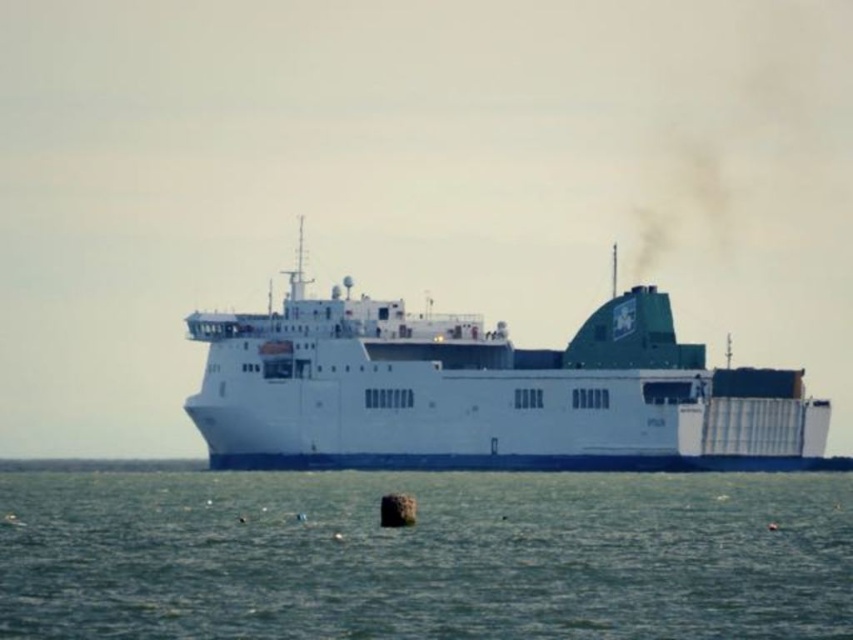
Question: Which of the following is the farthest from the observer?

Choices:
 (A) (218, 456)
 (B) (123, 637)

Answer: (A)

Question: Which point is closer to the camera taking this photo?

Choices:
 (A) (664, 429)
 (B) (469, 561)

Answer: (B)

Question: Does greenish-blue water at center have a larger size compared to white matte ship at center?

Choices:
 (A) yes
 (B) no

Answer: (B)

Question: Does greenish-blue water at center appear over white matte ship at center?

Choices:
 (A) no
 (B) yes

Answer: (A)

Question: Is greenish-blue water at center positioned in front of white matte ship at center?

Choices:
 (A) yes
 (B) no

Answer: (A)

Question: Which object is closer to the camera taking this photo?

Choices:
 (A) white matte ship at center
 (B) greenish-blue water at center

Answer: (B)